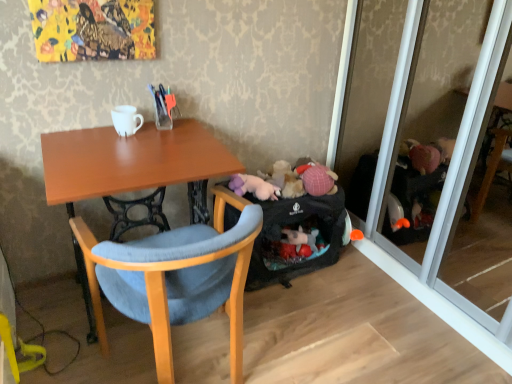
The height and width of the screenshot is (384, 512). Identify the location of free space in front of black fabric luggage at lower right. [x=306, y=319].